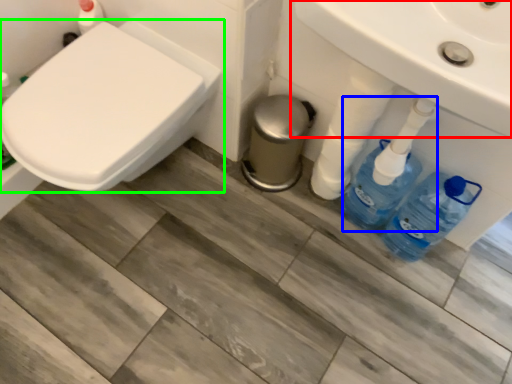
Question: Estimate the real-world distances between objects in this image. Which object is closer to sink (highlighted by a red box), cleaning product (highlighted by a blue box) or toilet (highlighted by a green box)?

Choices:
 (A) cleaning product
 (B) toilet

Answer: (A)